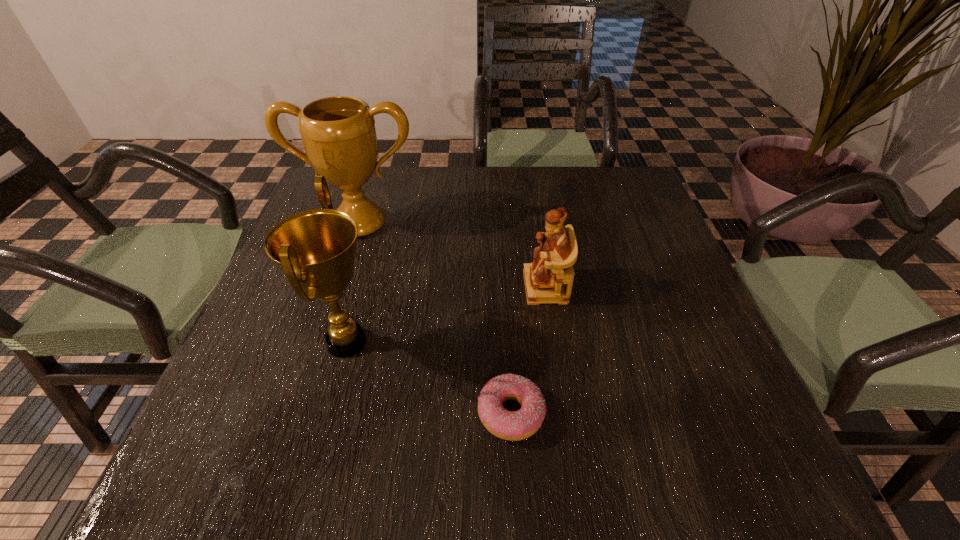
The image size is (960, 540). I want to click on the farther award, so click(338, 133).

Locate an element on the screen. The height and width of the screenshot is (540, 960). the nearer award is located at coordinates (316, 249).

Where is `the second shortest object`? the second shortest object is located at coordinates (549, 278).

This screenshot has width=960, height=540. I want to click on doughnut, so click(x=518, y=425).

Find the location of `free space located 0.320m on the front of the farther award with the decoration`. free space located 0.320m on the front of the farther award with the decoration is located at coordinates (319, 351).

At what (x,y) coordinates should I click in order to perform the action: click on free location located on the front view with handles of the nearer award. Please return your answer as a coordinate pair (x, y). Looking at the image, I should click on (533, 342).

The width and height of the screenshot is (960, 540). What are the coordinates of `free space located on the front-facing side of the figurine` in the screenshot? It's located at (442, 287).

This screenshot has width=960, height=540. Find the location of `free location located on the front-facing side of the figurine`. free location located on the front-facing side of the figurine is located at coordinates (419, 287).

Where is `free space located 0.150m on the front-facing side of the figurine`? The image size is (960, 540). free space located 0.150m on the front-facing side of the figurine is located at coordinates (456, 287).

Find the location of a particular element. free location located 0.120m on the back of the doughnut is located at coordinates (507, 331).